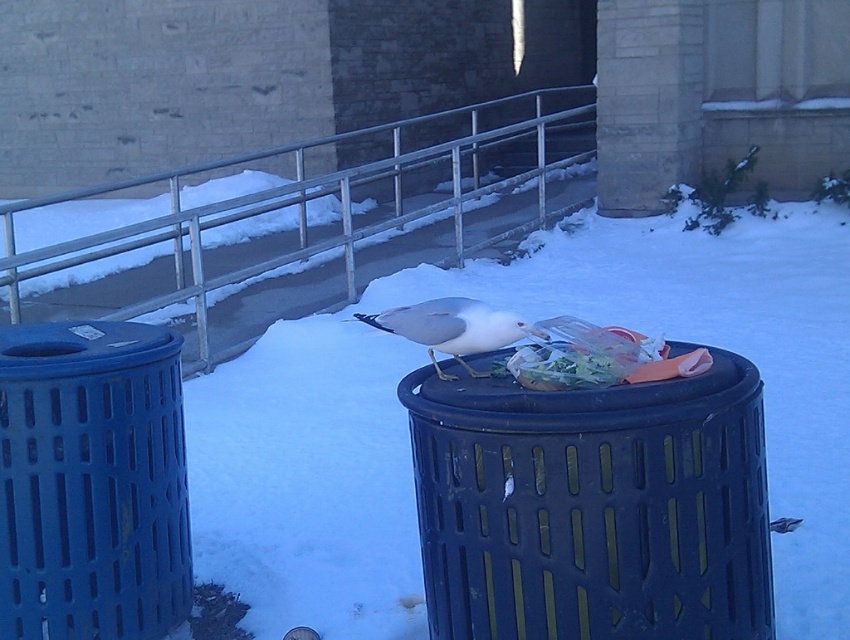
You are a delivery person with a package that needs to be placed between the matte black trash can at center and the blue plastic trash can at left. The package measures 4 feet in length. Can you fit it between them without moving either trash can?

The distance between the matte black trash can at center and the blue plastic trash can at left is 4.01 feet. Since the package is 4 feet long, it can fit between them as there is enough space.

You are a sanitation worker trying to determine which trash can is shorter. You see the matte black trash can at center and the blue plastic trash can at left. Which one is shorter?

The matte black trash can at center has a lesser height compared to the blue plastic trash can at left, so the matte black trash can at center is shorter.

You are standing at the origin point of the coordinate system. You want to throw a snowball to hit the white powder snow at center. What are the coordinates you should aim for?

You should aim for the coordinates point at (717, 346) to hit the white powder snow at center.